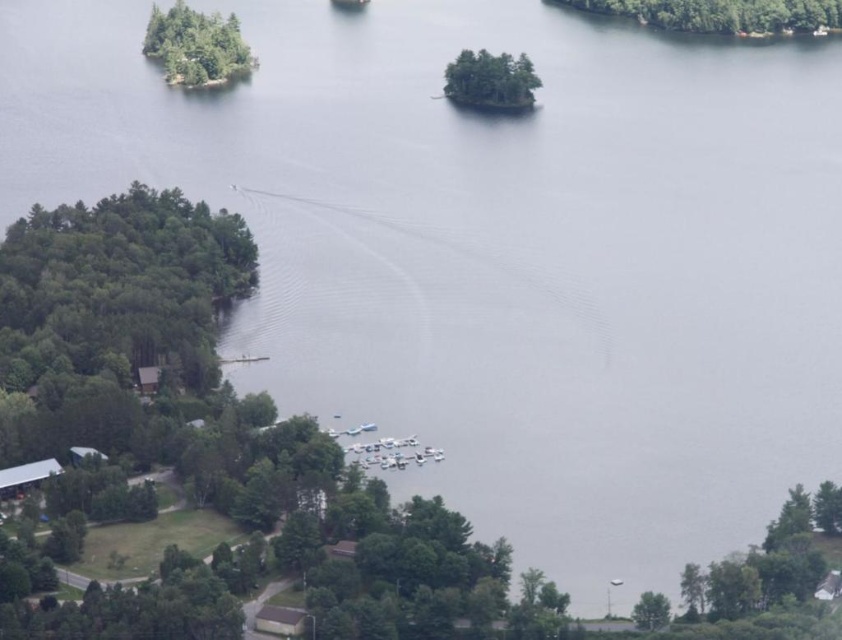
What do you see at coordinates (723, 13) in the screenshot? I see `green leafy trees at upper right` at bounding box center [723, 13].

Find the location of a particular element. The height and width of the screenshot is (640, 842). green leafy trees at upper right is located at coordinates [x=723, y=13].

Where is `green leafy trees at upper right`? This screenshot has height=640, width=842. green leafy trees at upper right is located at coordinates (723, 13).

Which is more to the right, green leafy trees at upper left or green matte tree at lower right?

From the viewer's perspective, green matte tree at lower right appears more on the right side.

Can you confirm if green leafy trees at upper left is positioned below green matte tree at lower right?

Incorrect, green leafy trees at upper left is not positioned below green matte tree at lower right.

Is point (200, 26) positioned in front of point (659, 596)?

No, (200, 26) is further to viewer.

I want to click on green leafy trees at upper left, so click(x=196, y=45).

Does green leafy tree at lower right have a lesser width compared to green leafy trees at center?

No.

Can you confirm if green leafy tree at lower right is positioned to the right of green leafy trees at center?

Correct, you'll find green leafy tree at lower right to the right of green leafy trees at center.

Is point (793, 534) positioned before point (456, 58)?

Yes, it is.

Identify the location of green leafy tree at lower right. click(761, 582).